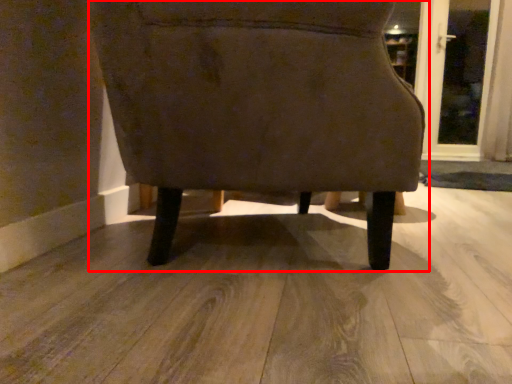
Question: Observing the image, what is the correct spatial positioning of chair (annotated by the red box) in reference to screen door?

Choices:
 (A) left
 (B) right

Answer: (A)